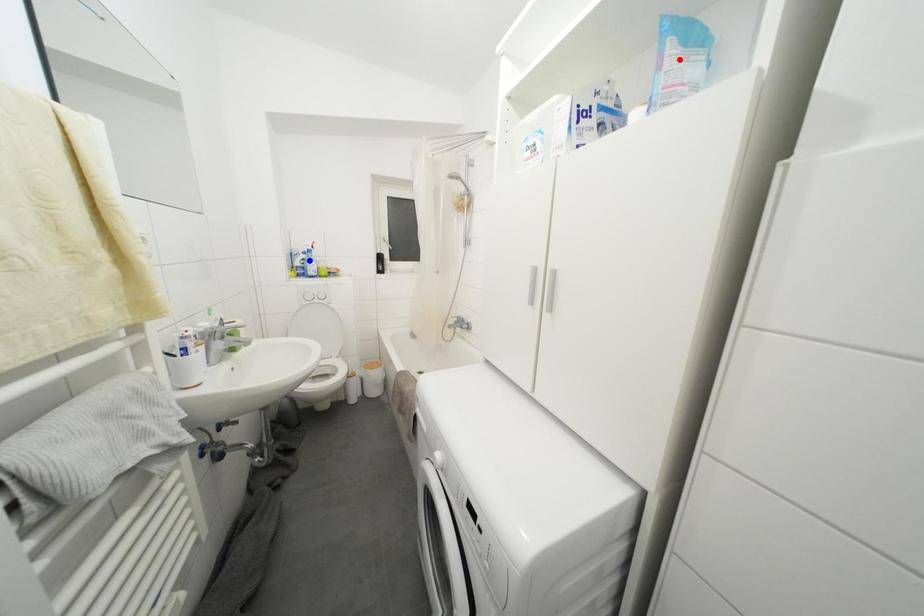
Question: Which of the two points in the image is closer to the camera?

Choices:
 (A) Blue point is closer.
 (B) Red point is closer.

Answer: (B)